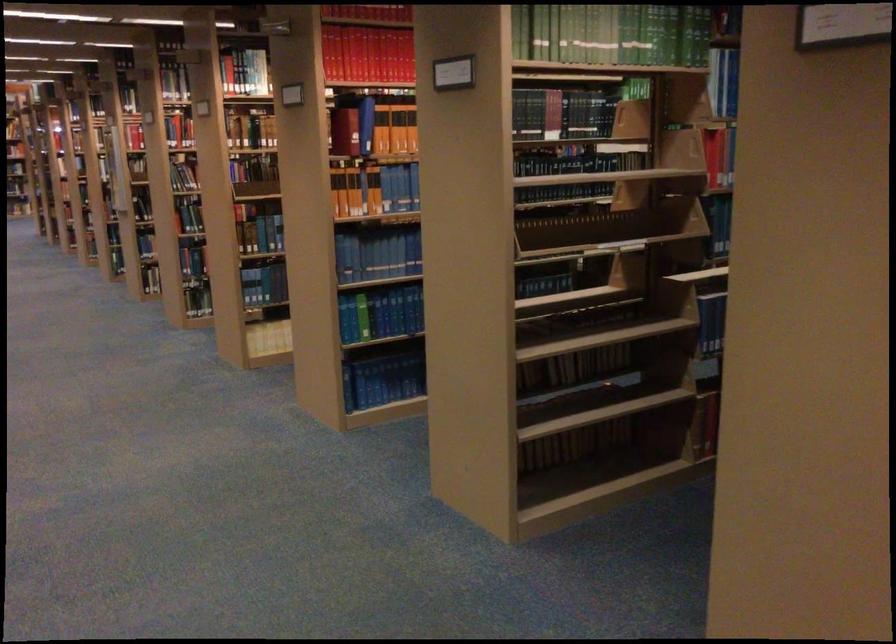
The height and width of the screenshot is (644, 896). What are the coordinates of `red book` in the screenshot? It's located at (366, 55).